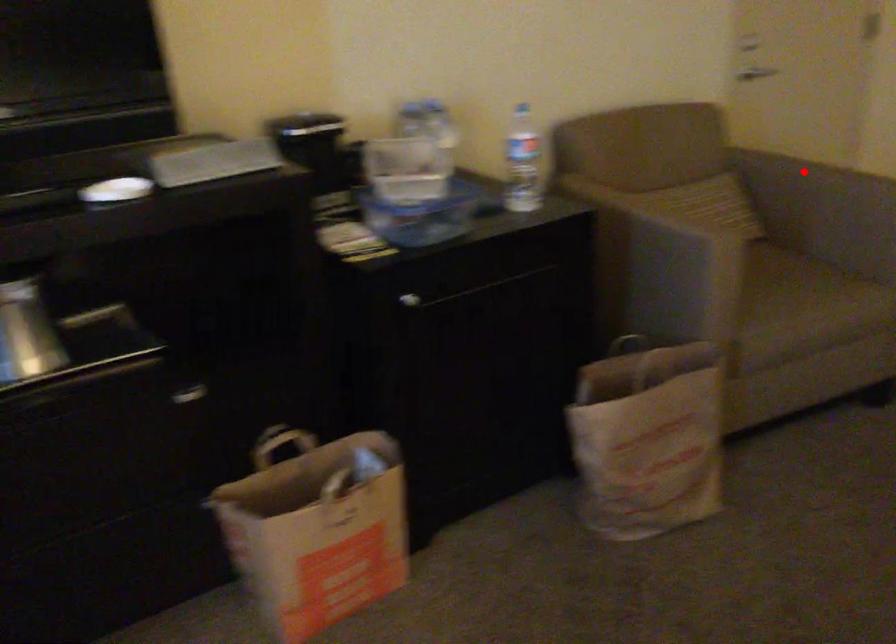
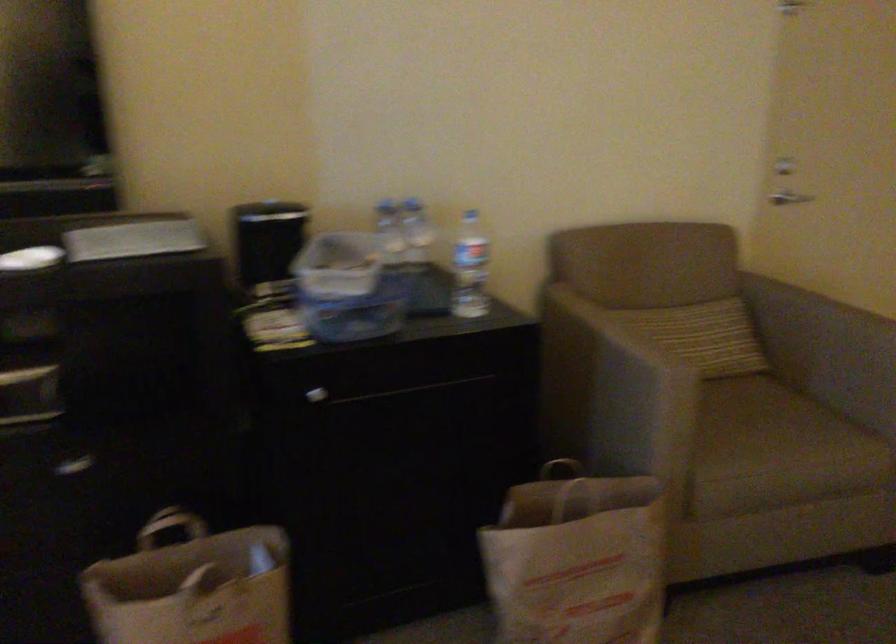
Question: I am providing you with two images of the same scene from different viewpoints. A red point is marked on the first image. Can you still see the location of the red point in image 2?

Choices:
 (A) Yes
 (B) No

Answer: (A)